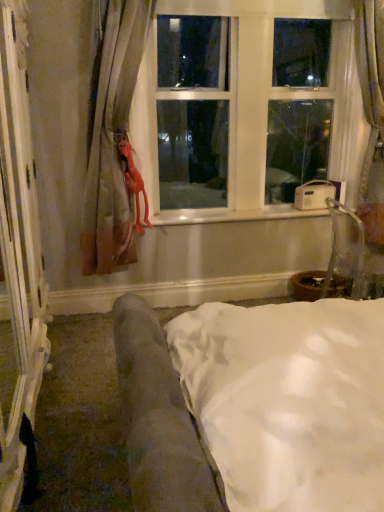
Question: Can you confirm if velvet fabric couch at lower left is shorter than clear plastic armchair at right?

Choices:
 (A) yes
 (B) no

Answer: (B)

Question: Can you confirm if velvet fabric couch at lower left is thinner than clear plastic armchair at right?

Choices:
 (A) no
 (B) yes

Answer: (A)

Question: From the image's perspective, would you say velvet fabric couch at lower left is positioned over clear plastic armchair at right?

Choices:
 (A) no
 (B) yes

Answer: (A)

Question: Considering the relative sizes of velvet fabric couch at lower left and clear plastic armchair at right in the image provided, is velvet fabric couch at lower left taller than clear plastic armchair at right?

Choices:
 (A) yes
 (B) no

Answer: (A)

Question: Does velvet fabric couch at lower left come in front of clear plastic armchair at right?

Choices:
 (A) yes
 (B) no

Answer: (A)

Question: In terms of width, does rubber orange at left look wider or thinner when compared to matte beige curtain at left?

Choices:
 (A) thin
 (B) wide

Answer: (A)

Question: Is rubber orange at left spatially inside matte beige curtain at left, or outside of it?

Choices:
 (A) inside
 (B) outside

Answer: (A)

Question: Is rubber orange at left in front of or behind matte beige curtain at left in the image?

Choices:
 (A) front
 (B) behind

Answer: (B)

Question: From their relative heights in the image, would you say rubber orange at left is taller or shorter than matte beige curtain at left?

Choices:
 (A) short
 (B) tall

Answer: (A)

Question: Is white plastic window at upper center spatially inside velvet fabric couch at lower left, or outside of it?

Choices:
 (A) outside
 (B) inside

Answer: (A)

Question: Considering the positions of white plastic window at upper center and velvet fabric couch at lower left in the image, is white plastic window at upper center bigger or smaller than velvet fabric couch at lower left?

Choices:
 (A) big
 (B) small

Answer: (B)

Question: Based on their positions, is white plastic window at upper center located to the left or right of velvet fabric couch at lower left?

Choices:
 (A) left
 (B) right

Answer: (A)

Question: In the image, is white plastic window at upper center positioned in front of or behind velvet fabric couch at lower left?

Choices:
 (A) front
 (B) behind

Answer: (B)

Question: From the image's perspective, is rubber orange at left positioned above or below velvet fabric couch at lower left?

Choices:
 (A) below
 (B) above

Answer: (B)

Question: Is rubber orange at left in front of or behind velvet fabric couch at lower left in the image?

Choices:
 (A) behind
 (B) front

Answer: (A)